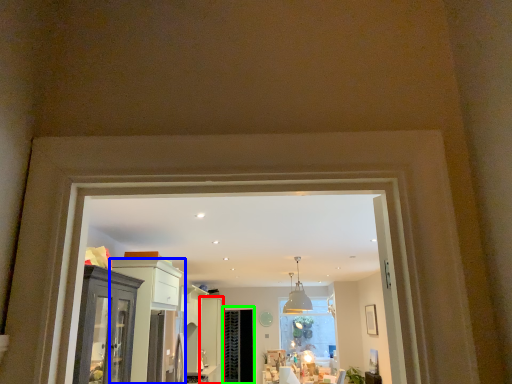
Question: Which object is the farthest from door (highlighted by a red box)? Choose among these: cabinetry (highlighted by a blue box) or screen door (highlighted by a green box).

Choices:
 (A) cabinetry
 (B) screen door

Answer: (A)